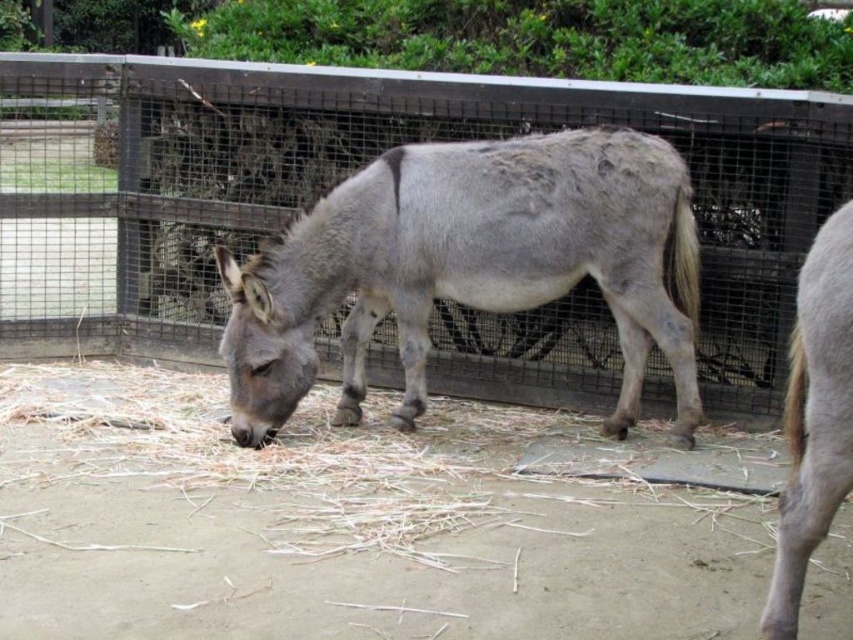
Question: Which point is farther to the camera?

Choices:
 (A) (53, 168)
 (B) (641, 340)
 (C) (805, 422)

Answer: (A)

Question: Estimate the real-world distances between objects in this image. Which object is closer to the wooden fence at center?

Choices:
 (A) gray matte horse at right
 (B) gray matte donkey at center

Answer: (B)

Question: Is wooden fence at center above gray matte horse at right?

Choices:
 (A) yes
 (B) no

Answer: (A)

Question: Which object appears farthest from the camera in this image?

Choices:
 (A) gray matte donkey at center
 (B) gray matte horse at right

Answer: (A)

Question: Does gray matte donkey at center appear on the left side of gray matte horse at right?

Choices:
 (A) yes
 (B) no

Answer: (A)

Question: Is wooden fence at center closer to camera compared to gray matte donkey at center?

Choices:
 (A) yes
 (B) no

Answer: (B)